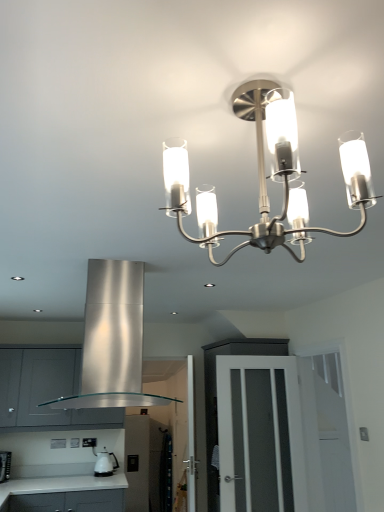
Question: Does white glossy kettle at lower left have a lesser width compared to satin silver cabinet at lower left?

Choices:
 (A) no
 (B) yes

Answer: (B)

Question: Is white glossy kettle at lower left at the left side of satin silver cabinet at lower left?

Choices:
 (A) no
 (B) yes

Answer: (A)

Question: Does white glossy kettle at lower left come in front of satin silver cabinet at lower left?

Choices:
 (A) yes
 (B) no

Answer: (B)

Question: From the image's perspective, is white glossy kettle at lower left on satin silver cabinet at lower left?

Choices:
 (A) yes
 (B) no

Answer: (B)

Question: Considering the relative positions of white glossy kettle at lower left and satin silver cabinet at lower left in the image provided, is white glossy kettle at lower left to the right of satin silver cabinet at lower left from the viewer's perspective?

Choices:
 (A) yes
 (B) no

Answer: (A)

Question: Considering the positions of satin nickel chandelier at upper center and white glossy kettle at lower left in the image, is satin nickel chandelier at upper center bigger or smaller than white glossy kettle at lower left?

Choices:
 (A) small
 (B) big

Answer: (B)

Question: From the image's perspective, is satin nickel chandelier at upper center above or below white glossy kettle at lower left?

Choices:
 (A) above
 (B) below

Answer: (A)

Question: From a real-world perspective, is satin nickel chandelier at upper center above or below white glossy kettle at lower left?

Choices:
 (A) above
 (B) below

Answer: (A)

Question: Does point (256, 117) appear closer or farther from the camera than point (104, 450)?

Choices:
 (A) closer
 (B) farther

Answer: (A)

Question: In the image, is stainless steel exhaust hood at center on the left side or the right side of satin nickel chandelier at upper center?

Choices:
 (A) left
 (B) right

Answer: (A)

Question: From a real-world perspective, is stainless steel exhaust hood at center positioned above or below satin nickel chandelier at upper center?

Choices:
 (A) above
 (B) below

Answer: (B)

Question: From the image's perspective, is stainless steel exhaust hood at center above or below satin nickel chandelier at upper center?

Choices:
 (A) above
 (B) below

Answer: (B)

Question: Does point (137, 380) appear closer or farther from the camera than point (362, 162)?

Choices:
 (A) farther
 (B) closer

Answer: (A)

Question: Would you say clear glass door at center is inside or outside stainless steel exhaust hood at center?

Choices:
 (A) outside
 (B) inside

Answer: (A)

Question: Is point (269, 376) closer or farther from the camera than point (135, 370)?

Choices:
 (A) closer
 (B) farther

Answer: (B)